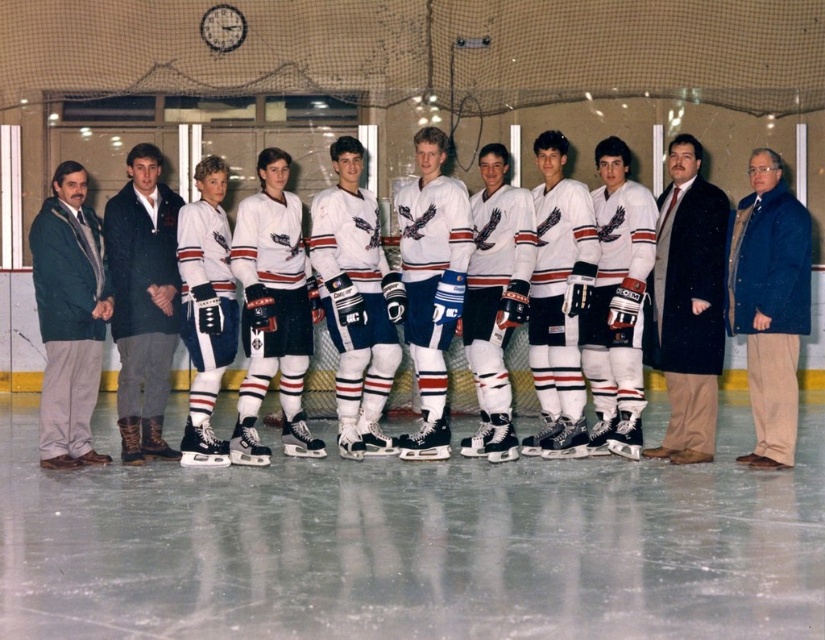
Can you confirm if white ice at center is shorter than dark blue corduroy pants at center?

Yes, white ice at center is shorter than dark blue corduroy pants at center.

Does white ice at center have a smaller size compared to dark blue corduroy pants at center?

Yes, white ice at center is smaller than dark blue corduroy pants at center.

In order to click on white ice at center in this screenshot , I will do `click(413, 547)`.

Identify the location of white ice at center. (413, 547).

Between green wool jacket at left and white jersey at center, which one has less height?

green wool jacket at left is shorter.

Does green wool jacket at left appear over white jersey at center?

Actually, green wool jacket at left is below white jersey at center.

Where is `green wool jacket at left`? green wool jacket at left is located at coordinates (69, 317).

Does blue textured coat at right appear under green wool jacket at left?

No, blue textured coat at right is not below green wool jacket at left.

You are a GUI agent. You are given a task and a screenshot of the screen. Output one action in this format:
    pyautogui.click(x=<x>, y=<y>)
    Task: Click on the blue textured coat at right
    
    Given the screenshot: What is the action you would take?
    771,304

Identify the location of blue textured coat at right. This screenshot has width=825, height=640. (771, 304).

The width and height of the screenshot is (825, 640). Identify the location of blue textured coat at right. (771, 304).